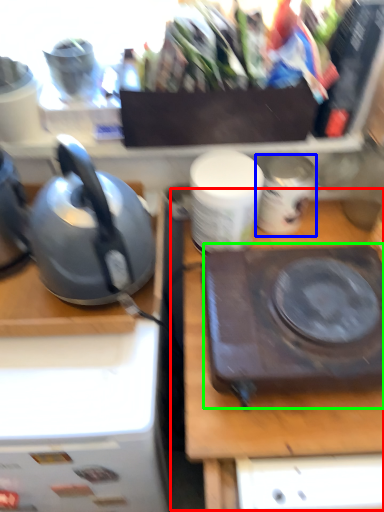
Question: Which is farther away from table (highlighted by a red box)? appliance (highlighted by a blue box) or kitchen appliance (highlighted by a green box)?

Choices:
 (A) appliance
 (B) kitchen appliance

Answer: (A)